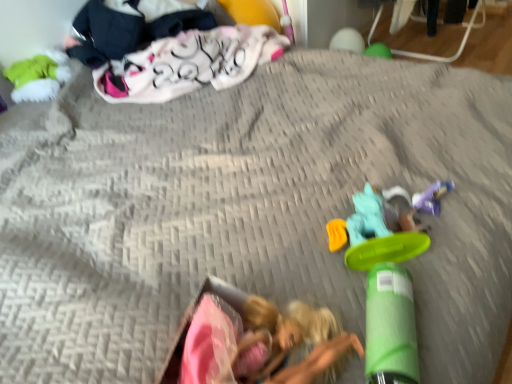
Question: Is green matte cylinder at lower right, positioned as the fourth toy in top-to-bottom order, far from purple plastic toy at lower right, the second toy positioned from the back?

Choices:
 (A) yes
 (B) no

Answer: (B)

Question: Is purple plastic toy at lower right, marked as the third toy in a bottom-to-top arrangement, at the back of green matte cylinder at lower right, which is the 4th toy from back to front?

Choices:
 (A) no
 (B) yes

Answer: (A)

Question: Would you say green matte cylinder at lower right, the 1th toy in the bottom-to-top sequence, contains purple plastic toy at lower right, which appears as the 3th toy when viewed from the front?

Choices:
 (A) no
 (B) yes

Answer: (A)

Question: Considering the relative positions of green matte cylinder at lower right, which is the 4th toy from back to front, and purple plastic toy at lower right, which appears as the 3th toy when viewed from the front, in the image provided, is green matte cylinder at lower right, which is the 4th toy from back to front, to the left of purple plastic toy at lower right, which appears as the 3th toy when viewed from the front, from the viewer's perspective?

Choices:
 (A) yes
 (B) no

Answer: (A)

Question: Is green matte cylinder at lower right, which ranks as the second toy in left-to-right order, behind purple plastic toy at lower right, placed as the 2th toy when sorted from top to bottom?

Choices:
 (A) no
 (B) yes

Answer: (A)

Question: Is dark blue fabric at upper left, acting as the 1th clothing starting from the left, wider or thinner than purple plastic toy at lower right, marked as the third toy in a bottom-to-top arrangement?

Choices:
 (A) thin
 (B) wide

Answer: (B)

Question: From a real-world perspective, is dark blue fabric at upper left, acting as the 1th clothing starting from the left, positioned above or below purple plastic toy at lower right, placed as the 2th toy when sorted from top to bottom?

Choices:
 (A) below
 (B) above

Answer: (B)

Question: Considering the positions of dark blue fabric at upper left, acting as the 1th clothing starting from the left, and purple plastic toy at lower right, which is counted as the first toy, starting from the right, in the image, is dark blue fabric at upper left, acting as the 1th clothing starting from the left, taller or shorter than purple plastic toy at lower right, which is counted as the first toy, starting from the right,?

Choices:
 (A) tall
 (B) short

Answer: (A)

Question: Is dark blue fabric at upper left, acting as the 1th clothing starting from the left, inside or outside of purple plastic toy at lower right, which is counted as the first toy, starting from the right?

Choices:
 (A) inside
 (B) outside

Answer: (B)

Question: From the image's perspective, relative to matte green plush at upper left, acting as the 4th toy starting from the right, is dark blue fabric at upper left, acting as the 1th clothing starting from the left, above or below?

Choices:
 (A) above
 (B) below

Answer: (A)

Question: From their relative heights in the image, would you say dark blue fabric at upper left, which is counted as the second clothing, starting from the right, is taller or shorter than matte green plush at upper left, the 1th toy from the back?

Choices:
 (A) tall
 (B) short

Answer: (A)

Question: In terms of width, does dark blue fabric at upper left, which is counted as the second clothing, starting from the right, look wider or thinner when compared to matte green plush at upper left, the 1th toy from the back?

Choices:
 (A) thin
 (B) wide

Answer: (B)

Question: Is point (124, 34) closer or farther from the camera than point (19, 100)?

Choices:
 (A) farther
 (B) closer

Answer: (A)

Question: Considering their positions, is green matte cylinder at lower right, the 3th toy when ordered from right to left, located in front of or behind fluffy pink blanket at upper left, the second clothing viewed from the left?

Choices:
 (A) behind
 (B) front

Answer: (B)

Question: In terms of height, does green matte cylinder at lower right, which is the 4th toy from back to front, look taller or shorter compared to fluffy pink blanket at upper left, marked as the first clothing in a right-to-left arrangement?

Choices:
 (A) tall
 (B) short

Answer: (B)